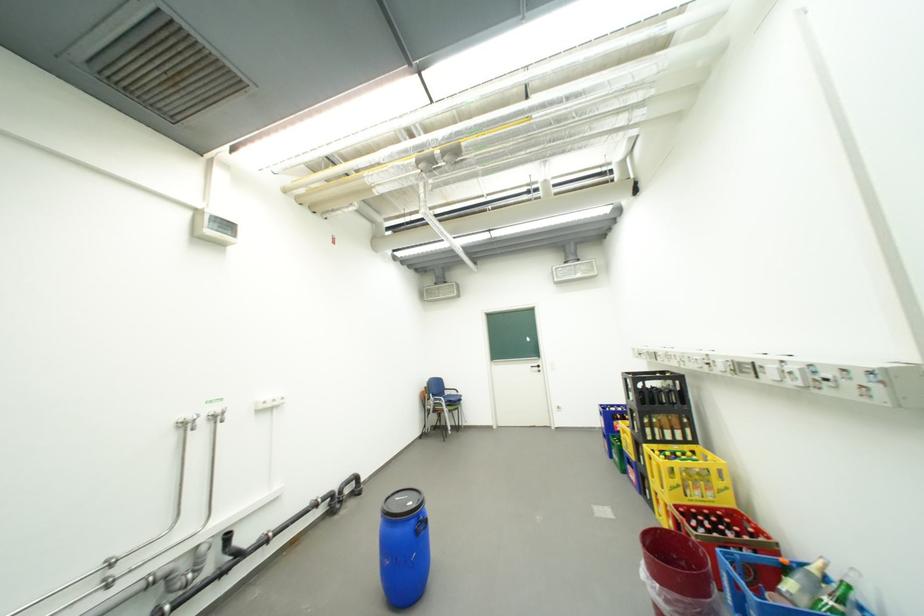
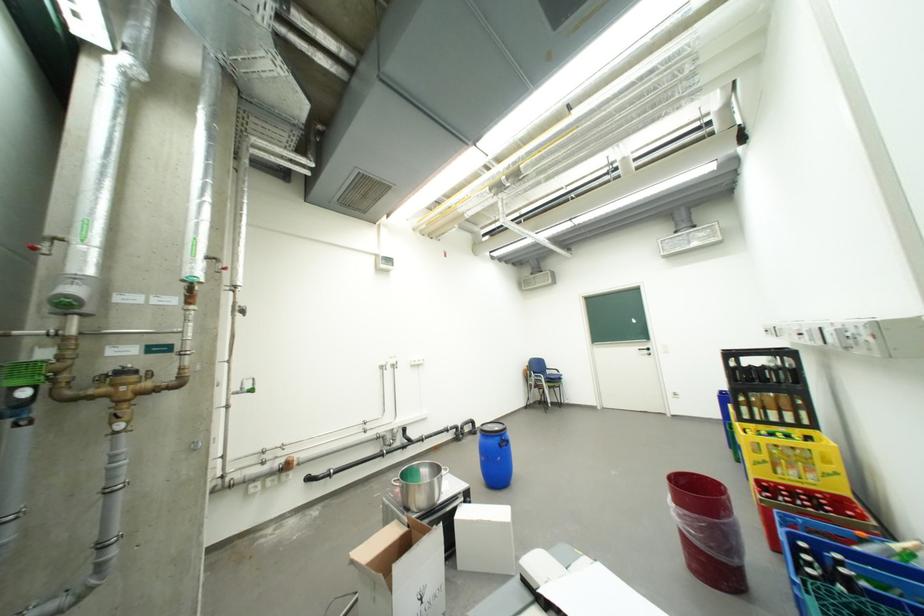
In the second image, find the point that corresponds to [422,519] in the first image.

(507, 438)